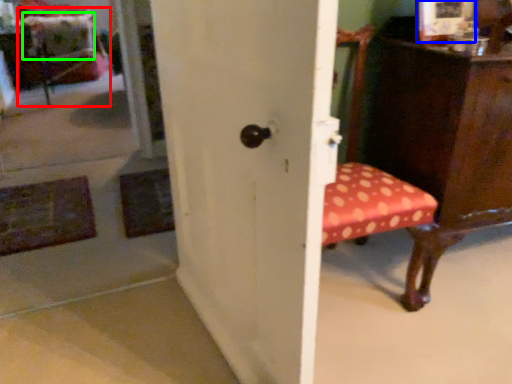
Question: Based on their relative distances, which object is nearer to swivel chair (highlighted by a red box)? Choose from picture frame (highlighted by a blue box) and pillow (highlighted by a green box).

Choices:
 (A) picture frame
 (B) pillow

Answer: (B)